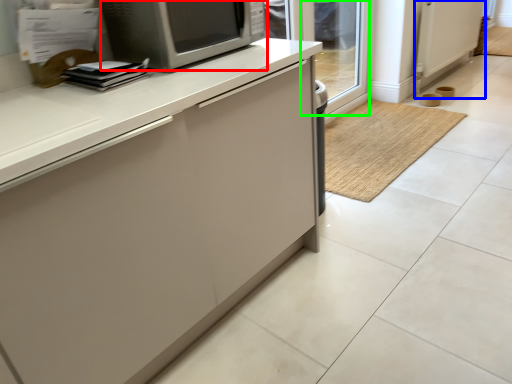
Question: Estimate the real-world distances between objects in this image. Which object is farther from microwave oven (highlighted by a red box), screen door (highlighted by a blue box) or glass door (highlighted by a green box)?

Choices:
 (A) screen door
 (B) glass door

Answer: (A)